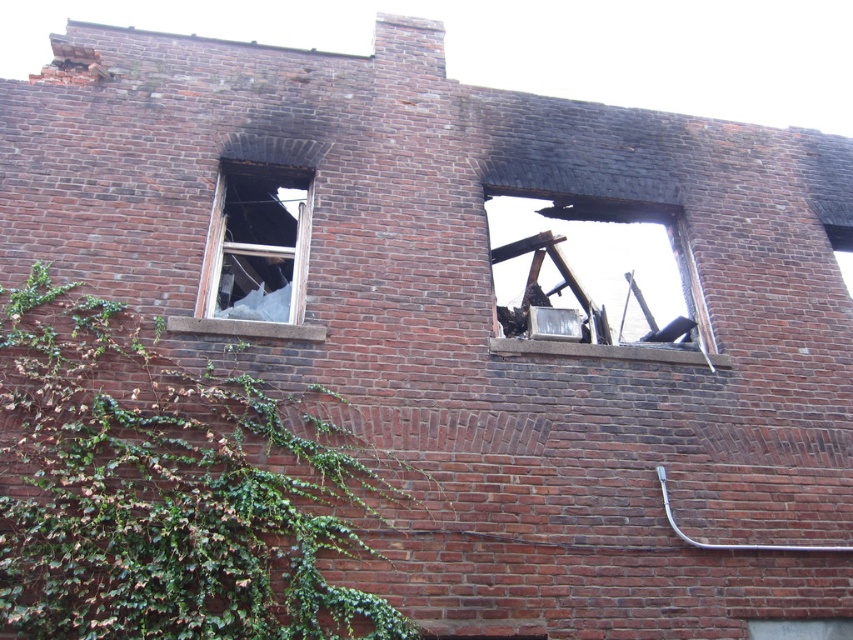
You are a firefighter assessing the structural integrity of the damaged brick building. You notice a point marked at coordinates (164, 490). What is the significance of this point?

The point at (164, 490) marks the location of green leafy ivy at left, which may indicate areas of the wall that have been less exposed to heat or structural stress compared to the more damaged sections.

You are a firefighter assessing the stability of a damaged building. You notice two objects of concern in the image. The first is charcoal wood debris at upper center, and the second is transparent glass window at upper left. Which of these two objects is larger in size?

The charcoal wood debris at upper center is bigger than the transparent glass window at upper left according to the description.

Consider the image. You are a drone operator trying to navigate through the ruins of the building. You see two points marked on your map at coordinates point (79, 410) and point (675, 262). Your task is to fly from the starting point to the exit located at the second point. Which point should you fly towards first?

You should fly towards point (79, 410) first because it is in front of point (675, 262), meaning it is closer to your current position and the logical path to reach the exit.